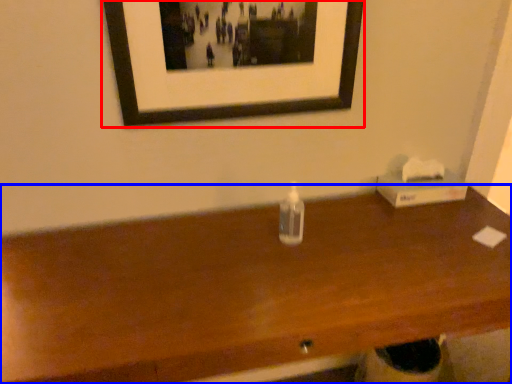
Question: Which of the following is the farthest to the observer, picture frame (highlighted by a red box) or table (highlighted by a blue box)?

Choices:
 (A) picture frame
 (B) table

Answer: (A)